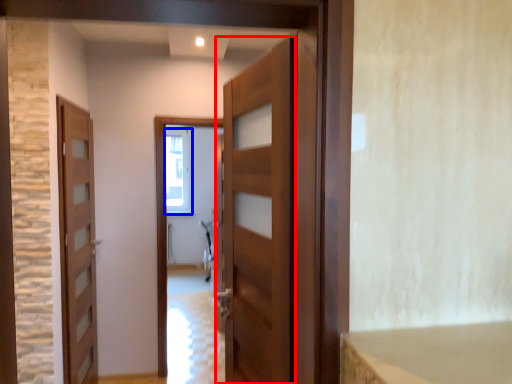
Question: Which object appears farthest to the camera in this image, door (highlighted by a red box) or window (highlighted by a blue box)?

Choices:
 (A) door
 (B) window

Answer: (B)